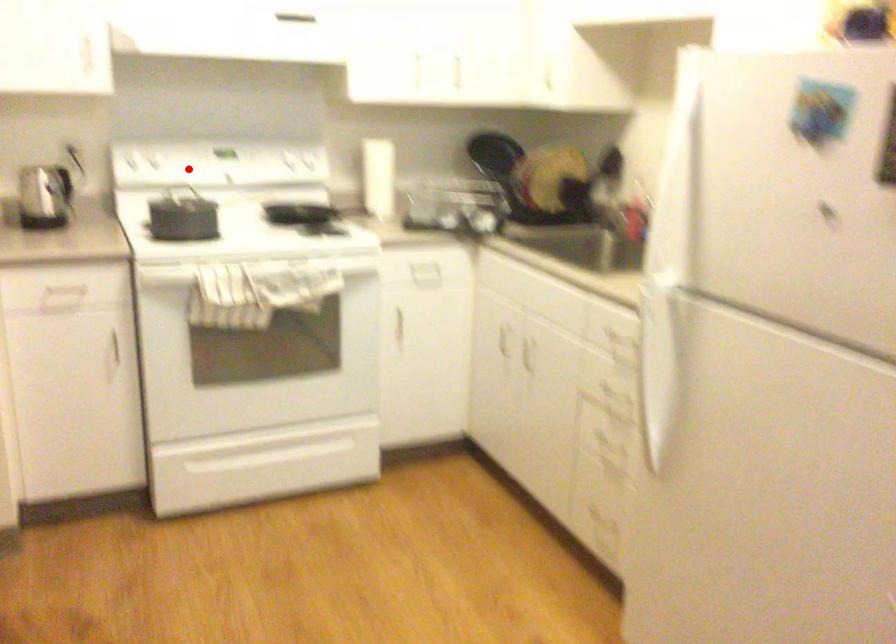
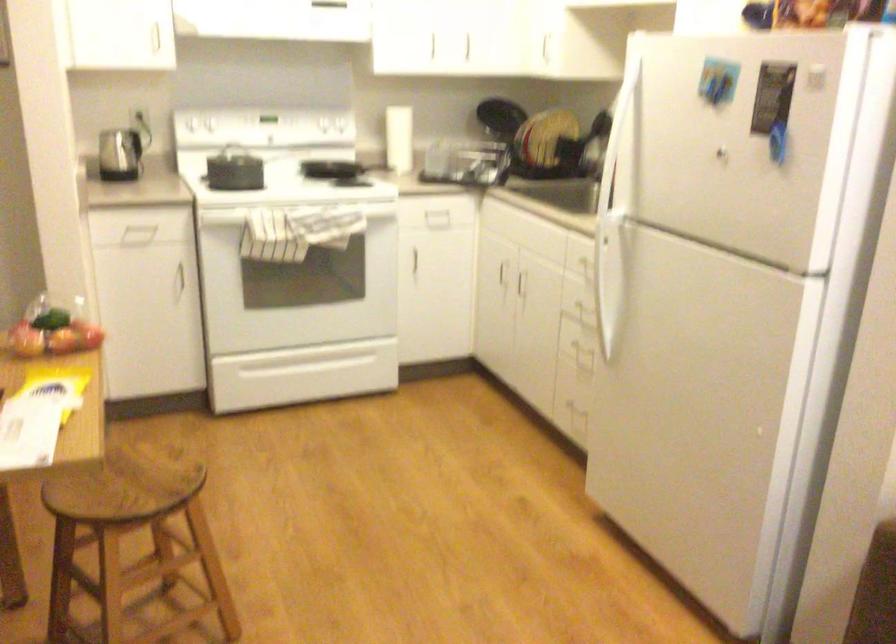
Question: I am providing you with two images of the same scene from different viewpoints. In image1, a red point is highlighted. Considering the same 3D point in image2, which of the following is correct?

Choices:
 (A) It is closer
 (B) It is farther

Answer: (B)